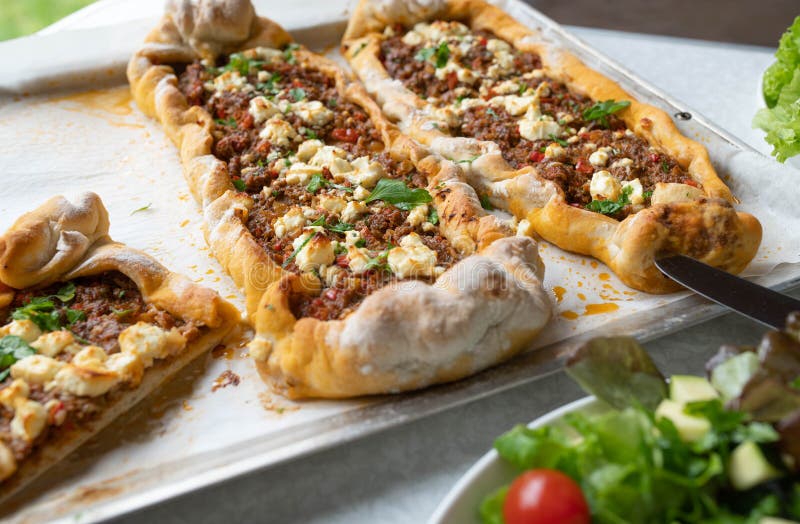
At what (x,y) coordinates should I click in order to perform the action: click on table. Please return your answer as a coordinate pair (x, y). This screenshot has height=524, width=800. Looking at the image, I should click on (418, 477).